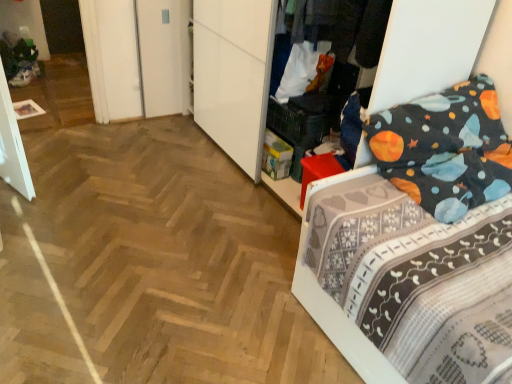
Question: From a real-world perspective, is dark gray fabric at upper center below dark blue fabric bed at right?

Choices:
 (A) yes
 (B) no

Answer: (B)

Question: Is dark gray fabric at upper center thinner than dark blue fabric bed at right?

Choices:
 (A) no
 (B) yes

Answer: (B)

Question: Is dark gray fabric at upper center oriented towards dark blue fabric bed at right?

Choices:
 (A) no
 (B) yes

Answer: (A)

Question: Would you say dark gray fabric at upper center is a long distance from dark blue fabric bed at right?

Choices:
 (A) no
 (B) yes

Answer: (A)

Question: Can you confirm if dark gray fabric at upper center is positioned to the right of dark blue fabric bed at right?

Choices:
 (A) no
 (B) yes

Answer: (A)

Question: Is dark gray fabric at upper center outside of dark blue fabric bed at right?

Choices:
 (A) yes
 (B) no

Answer: (A)

Question: Does dark blue fabric bed at right appear on the right side of dark gray fabric at upper center?

Choices:
 (A) no
 (B) yes

Answer: (B)

Question: Can you confirm if dark blue fabric bed at right is shorter than dark gray fabric at upper center?

Choices:
 (A) no
 (B) yes

Answer: (A)

Question: Considering the relative positions of dark blue fabric bed at right and dark gray fabric at upper center in the image provided, is dark blue fabric bed at right behind dark gray fabric at upper center?

Choices:
 (A) no
 (B) yes

Answer: (A)

Question: Does dark blue fabric bed at right have a greater height compared to dark gray fabric at upper center?

Choices:
 (A) yes
 (B) no

Answer: (A)

Question: Are dark blue fabric bed at right and dark gray fabric at upper center beside each other?

Choices:
 (A) no
 (B) yes

Answer: (A)

Question: Is dark blue fabric bed at right completely or partially outside of dark gray fabric at upper center?

Choices:
 (A) no
 (B) yes

Answer: (B)

Question: In terms of size, does dark gray fabric at upper center appear bigger or smaller than dark blue fabric bed at right?

Choices:
 (A) small
 (B) big

Answer: (A)